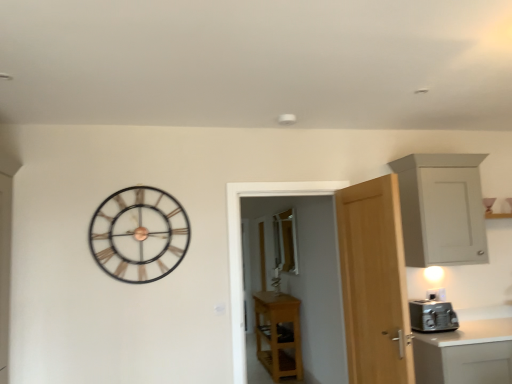
Question: Is light wood door at right not near white matte cabinet at upper right, the first cabinetry viewed from the right?

Choices:
 (A) no
 (B) yes

Answer: (A)

Question: From a real-world perspective, is light wood door at right below white matte cabinet at upper right, the first cabinetry viewed from the right?

Choices:
 (A) yes
 (B) no

Answer: (A)

Question: Can you confirm if light wood door at right is shorter than white matte cabinet at upper right, which is the 1th cabinetry in top-to-bottom order?

Choices:
 (A) no
 (B) yes

Answer: (A)

Question: From a real-world perspective, is light wood door at right physically above white matte cabinet at upper right, marked as the second cabinetry in a back-to-front arrangement?

Choices:
 (A) yes
 (B) no

Answer: (B)

Question: Considering the relative positions of light wood door at right and white matte cabinet at upper right, the first cabinetry viewed from the right, in the image provided, is light wood door at right to the right of white matte cabinet at upper right, the first cabinetry viewed from the right, from the viewer's perspective?

Choices:
 (A) yes
 (B) no

Answer: (B)

Question: In the image, is light wood door at right positioned in front of or behind light wood cabinet at center, which is the 2th cabinetry in front-to-back order?

Choices:
 (A) front
 (B) behind

Answer: (A)

Question: Considering the relative positions of light wood door at right and light wood cabinet at center, the second cabinetry when ordered from right to left, in the image provided, is light wood door at right to the left or to the right of light wood cabinet at center, the second cabinetry when ordered from right to left,?

Choices:
 (A) left
 (B) right

Answer: (B)

Question: Is light wood door at right taller or shorter than light wood cabinet at center, arranged as the first cabinetry when ordered from the bottom?

Choices:
 (A) tall
 (B) short

Answer: (A)

Question: From the image's perspective, relative to light wood cabinet at center, which is the first cabinetry in back-to-front order, is light wood door at right above or below?

Choices:
 (A) above
 (B) below

Answer: (A)

Question: Based on their positions, is clear glass window at center located to the left or right of light wood cabinet at center, arranged as the first cabinetry when ordered from the bottom?

Choices:
 (A) left
 (B) right

Answer: (B)

Question: Is clear glass window at center wider or thinner than light wood cabinet at center, which is the first cabinetry in back-to-front order?

Choices:
 (A) wide
 (B) thin

Answer: (B)

Question: Is point (288, 226) closer or farther from the camera than point (267, 314)?

Choices:
 (A) farther
 (B) closer

Answer: (A)

Question: Considering the positions of clear glass window at center and light wood cabinet at center, acting as the 2th cabinetry starting from the top, in the image, is clear glass window at center bigger or smaller than light wood cabinet at center, acting as the 2th cabinetry starting from the top,?

Choices:
 (A) big
 (B) small

Answer: (B)

Question: Looking at their shapes, would you say metallic silver toaster at right is wider or thinner than metallic gold clock at upper left?

Choices:
 (A) thin
 (B) wide

Answer: (B)

Question: Is metallic silver toaster at right inside the boundaries of metallic gold clock at upper left, or outside?

Choices:
 (A) outside
 (B) inside

Answer: (A)